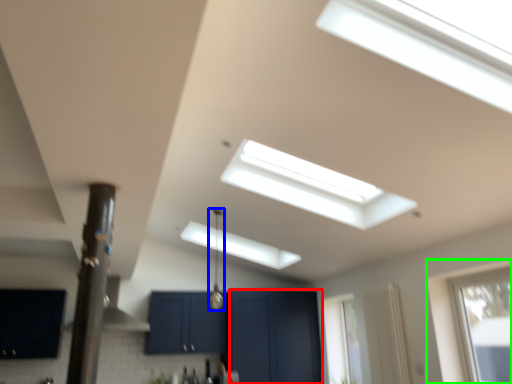
Question: Based on their relative distances, which object is nearer to screen door (highlighted by a red box)? Choose from light fixture (highlighted by a blue box) and window (highlighted by a green box).

Choices:
 (A) light fixture
 (B) window

Answer: (A)